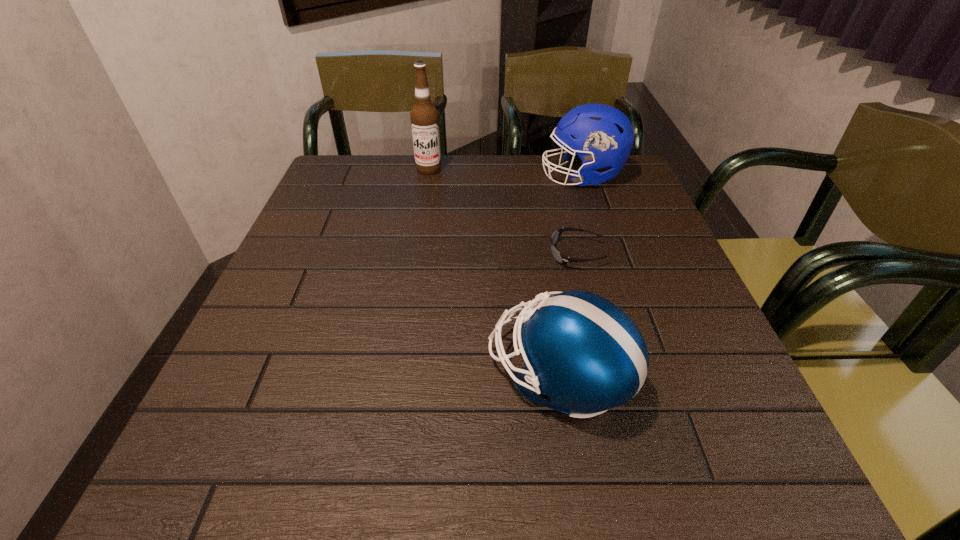
Where is `free space located 0.230m at the front of the nearest object with the faceguard`? free space located 0.230m at the front of the nearest object with the faceguard is located at coordinates (352, 375).

Identify the location of free space located 0.130m at the front of the nearest object with the faceguard. (412, 375).

This screenshot has height=540, width=960. Identify the location of vacant position located at the front of the nearest object with the faceguard. click(453, 375).

Locate an element on the screen. This screenshot has height=540, width=960. vacant space located on the lenses of the shortest object is located at coordinates (382, 254).

I want to click on free space located 0.060m on the lenses of the shortest object, so click(x=522, y=254).

Locate an element on the screen. This screenshot has height=540, width=960. free space located 0.050m on the lenses of the shortest object is located at coordinates (526, 254).

At what (x,y) coordinates should I click in order to perform the action: click on alcohol positioned at the far edge. Please return your answer as a coordinate pair (x, y). Image resolution: width=960 pixels, height=540 pixels. Looking at the image, I should click on (424, 116).

Identify the location of football helmet located at the far edge. Image resolution: width=960 pixels, height=540 pixels. (603, 136).

I want to click on football helmet at the right edge, so click(x=603, y=136).

This screenshot has height=540, width=960. In order to click on sunglasses at the right edge in this screenshot , I will do `click(559, 257)`.